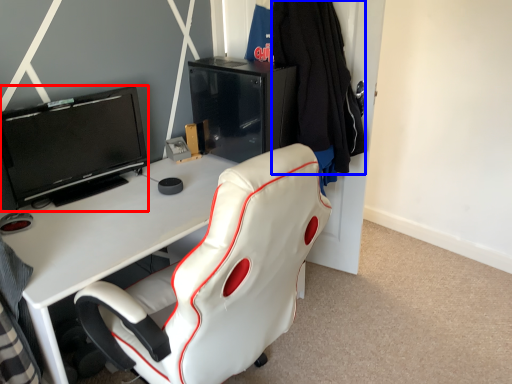
Question: Among these objects, which one is farthest to the camera, television (highlighted by a red box) or clothing (highlighted by a blue box)?

Choices:
 (A) television
 (B) clothing

Answer: (B)